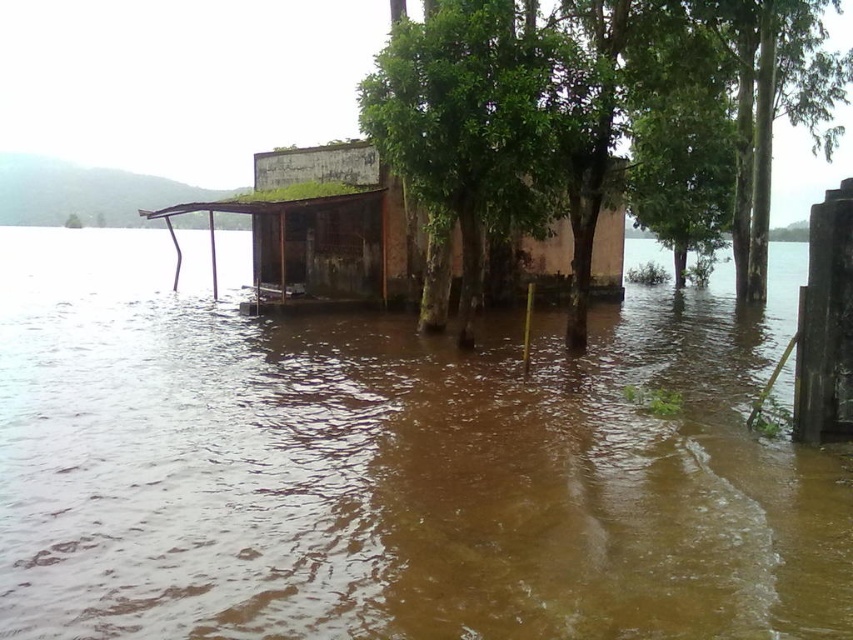
Question: Is green leafy tree at center closer to camera compared to rusty metal hut at center?

Choices:
 (A) yes
 (B) no

Answer: (A)

Question: Which object is farther from the camera taking this photo?

Choices:
 (A) brown muddy water at center
 (B) green leafy tree at center

Answer: (B)

Question: Among these objects, which one is farthest from the camera?

Choices:
 (A) rusty metal hut at center
 (B) brown muddy water at center

Answer: (A)

Question: Does brown muddy water at center lie in front of green leafy tree at center?

Choices:
 (A) yes
 (B) no

Answer: (A)

Question: Does brown muddy water at center have a smaller size compared to green leafy tree at center?

Choices:
 (A) no
 (B) yes

Answer: (B)

Question: Which object appears closest to the camera in this image?

Choices:
 (A) green leafy tree at center
 (B) rusty metal hut at center

Answer: (A)